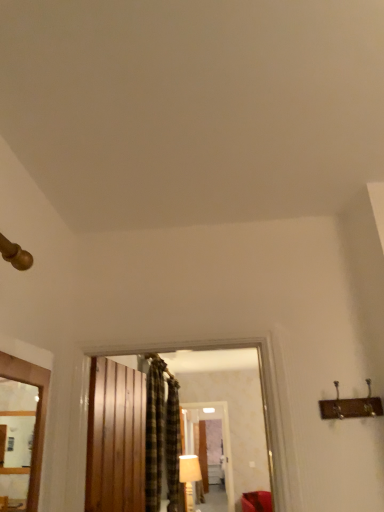
The width and height of the screenshot is (384, 512). What do you see at coordinates (36, 414) in the screenshot?
I see `wooden frame at left` at bounding box center [36, 414].

At what (x,y) coordinates should I click in order to perform the action: click on white fabric lampshade at center. Please return your answer as a coordinate pair (x, y). Image resolution: width=384 pixels, height=512 pixels. Looking at the image, I should click on (189, 477).

What do you see at coordinates (162, 436) in the screenshot? I see `plaid fabric curtain at center, placed as the second curtain when sorted from back to front` at bounding box center [162, 436].

Identify the location of plaid fabric curtain at center, arranged as the 1th curtain when viewed from the back. Image resolution: width=384 pixels, height=512 pixels. (173, 447).

Considering the sizes of wooden barn door at center and plaid fabric curtain at center, the 1th curtain viewed from the front, in the image, is wooden barn door at center wider or thinner than plaid fabric curtain at center, the 1th curtain viewed from the front,?

Clearly, wooden barn door at center has less width compared to plaid fabric curtain at center, the 1th curtain viewed from the front.

From the image's perspective, does wooden barn door at center appear lower than plaid fabric curtain at center, the 1th curtain viewed from the front?

Actually, wooden barn door at center appears above plaid fabric curtain at center, the 1th curtain viewed from the front, in the image.

Is point (132, 473) behind point (167, 422)?

No, it is not.

From the image's perspective, which object appears higher, white fabric lampshade at center or wooden frame at left?

wooden frame at left is shown above in the image.

Is white fabric lampshade at center in contact with wooden frame at left?

No, white fabric lampshade at center is not beside wooden frame at left.

Considering the positions of objects white fabric lampshade at center and wooden frame at left in the image provided, who is more to the left, white fabric lampshade at center or wooden frame at left?

wooden frame at left.

Considering the relative sizes of white fabric lampshade at center and wooden frame at left in the image provided, is white fabric lampshade at center taller than wooden frame at left?

Indeed, white fabric lampshade at center has a greater height compared to wooden frame at left.

Is plaid fabric curtain at center, arranged as the 1th curtain when viewed from the back, bigger or smaller than matte wooden mirror at center?

Clearly, plaid fabric curtain at center, arranged as the 1th curtain when viewed from the back, is smaller in size than matte wooden mirror at center.

Does point (182, 507) appear closer or farther from the camera than point (228, 425)?

Point (182, 507) appears to be closer to the viewer than point (228, 425).

Considering the relative positions of plaid fabric curtain at center, which is the 2th curtain in front-to-back order, and matte wooden mirror at center in the image provided, is plaid fabric curtain at center, which is the 2th curtain in front-to-back order, to the left or to the right of matte wooden mirror at center?

Based on their positions, plaid fabric curtain at center, which is the 2th curtain in front-to-back order, is located to the left of matte wooden mirror at center.

Do you think plaid fabric curtain at center, arranged as the 1th curtain when viewed from the back, is within matte wooden mirror at center, or outside of it?

plaid fabric curtain at center, arranged as the 1th curtain when viewed from the back, exists outside the volume of matte wooden mirror at center.

Is wooden barn door at center not near plaid fabric curtain at center, arranged as the 1th curtain when viewed from the back?

wooden barn door at center is positioned a significant distance from plaid fabric curtain at center, arranged as the 1th curtain when viewed from the back.

Between wooden barn door at center and plaid fabric curtain at center, arranged as the 1th curtain when viewed from the back, which one has smaller width?

Thinner between the two is wooden barn door at center.

Is plaid fabric curtain at center, arranged as the 1th curtain when viewed from the back, located within wooden barn door at center?

No, wooden barn door at center does not contain plaid fabric curtain at center, arranged as the 1th curtain when viewed from the back.

Can you confirm if wooden barn door at center is positioned to the left of plaid fabric curtain at center, which is the 2th curtain in front-to-back order?

Yes.

Is point (190, 502) positioned in front of point (147, 489)?

No.

Is white fabric lampshade at center taller than plaid fabric curtain at center, placed as the second curtain when sorted from back to front?

Incorrect, the height of white fabric lampshade at center is not larger of that of plaid fabric curtain at center, placed as the second curtain when sorted from back to front.

Locate an element on the screen. lamp to the right of plaid fabric curtain at center, placed as the second curtain when sorted from back to front is located at coordinates (189, 477).

Looking at this image, is white fabric lampshade at center positioned far away from plaid fabric curtain at center, the 1th curtain viewed from the front?

Yes, white fabric lampshade at center and plaid fabric curtain at center, the 1th curtain viewed from the front, are quite far apart.

Based on the photo, are white fabric lampshade at center and wooden barn door at center beside each other?

No, white fabric lampshade at center is not with wooden barn door at center.

From the image's perspective, is white fabric lampshade at center beneath wooden barn door at center?

Indeed, from the image's perspective, white fabric lampshade at center is shown beneath wooden barn door at center.

From a real-world perspective, relative to wooden barn door at center, is white fabric lampshade at center vertically above or below?

Clearly, from a real-world perspective, white fabric lampshade at center is below wooden barn door at center.

Does white fabric lampshade at center have a lesser height compared to wooden barn door at center?

Indeed, white fabric lampshade at center has a lesser height compared to wooden barn door at center.

From the image's perspective, which object appears higher, white fabric lampshade at center or plaid fabric curtain at center, which is the 2th curtain in front-to-back order?

plaid fabric curtain at center, which is the 2th curtain in front-to-back order, from the image's perspective.

From a real-world perspective, is white fabric lampshade at center on top of plaid fabric curtain at center, arranged as the 1th curtain when viewed from the back?

Incorrect, from a real-world perspective, white fabric lampshade at center is lower than plaid fabric curtain at center, arranged as the 1th curtain when viewed from the back.

Identify the location of the 1st curtain positioned above the white fabric lampshade at center (from the image's perspective). This screenshot has width=384, height=512. (173, 447).

Identify the location of barn door located on the left of plaid fabric curtain at center, the 1th curtain viewed from the front. The height and width of the screenshot is (512, 384). (115, 438).

Where is `lamp on the right of wooden frame at left`? lamp on the right of wooden frame at left is located at coordinates (189, 477).

From the image, which object appears to be farther from white fabric lampshade at center, plaid fabric curtain at center, which is the 2th curtain in front-to-back order, or wooden frame at left?

wooden frame at left lies further to white fabric lampshade at center than the other object.

Estimate the real-world distances between objects in this image. Which object is closer to white fabric lampshade at center, wooden barn door at center or plaid fabric curtain at center, arranged as the 1th curtain when viewed from the back?

Among the two, plaid fabric curtain at center, arranged as the 1th curtain when viewed from the back, is located nearer to white fabric lampshade at center.

Looking at the image, which one is located further to wooden frame at left, plaid fabric curtain at center, the 1th curtain viewed from the front, or matte wooden mirror at center?

Among the two, matte wooden mirror at center is located further to wooden frame at left.

Looking at the image, which one is located closer to matte wooden mirror at center, white fabric lampshade at center or plaid fabric curtain at center, placed as the second curtain when sorted from back to front?

Based on the image, white fabric lampshade at center appears to be nearer to matte wooden mirror at center.

Estimate the real-world distances between objects in this image. Which object is closer to wooden frame at left, white fabric lampshade at center or wooden barn door at center?

Among the two, wooden barn door at center is located nearer to wooden frame at left.

Which object lies further to the anchor point wooden barn door at center, plaid fabric curtain at center, placed as the second curtain when sorted from back to front, or plaid fabric curtain at center, which is the 2th curtain in front-to-back order?

Based on the image, plaid fabric curtain at center, which is the 2th curtain in front-to-back order, appears to be further to wooden barn door at center.

Which object lies further to the anchor point wooden barn door at center, white fabric lampshade at center or wooden frame at left?

Based on the image, white fabric lampshade at center appears to be further to wooden barn door at center.

Based on their spatial positions, is plaid fabric curtain at center, which is the 2th curtain in front-to-back order, or matte wooden mirror at center further from plaid fabric curtain at center, the 1th curtain viewed from the front?

matte wooden mirror at center.

Image resolution: width=384 pixels, height=512 pixels. Identify the location of lamp positioned between wooden frame at left and matte wooden mirror at center from near to far. (189, 477).

I want to click on curtain between wooden frame at left and plaid fabric curtain at center, which is the 2th curtain in front-to-back order, in the front-back direction, so click(x=162, y=436).

Locate an element on the screen. lamp between plaid fabric curtain at center, arranged as the 1th curtain when viewed from the back, and matte wooden mirror at center, along the z-axis is located at coordinates (189, 477).

Identify the location of barn door between wooden frame at left and plaid fabric curtain at center, arranged as the 1th curtain when viewed from the back, along the z-axis. (115, 438).